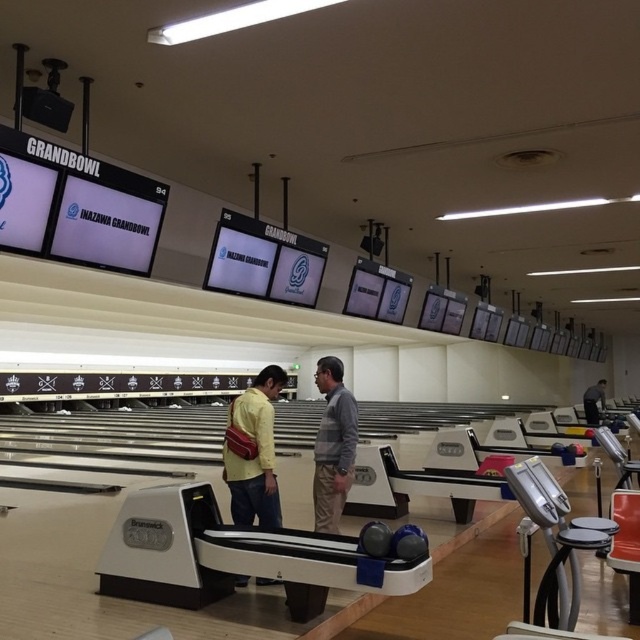
You are a customer at GRANDBOWL and you see two people wearing a yellow matte shirt at center and a gray sweater at center. Which one is on the left side?

The yellow matte shirt at center is to the left of the gray sweater at center, so the person wearing the yellow matte shirt at center is on the left side.

Based on the photo, you are standing at the entrance of GRANDBOWL and see a point marked at coordinates (253, 452). What object is located at that point?

The point at coordinates (253, 452) marks the yellow matte shirt at center.

You are a customer at GRANDBOWL and you see two people wearing the yellow matte shirt at center and the gray sweater at center. Which one is closer to the floor?

The yellow matte shirt at center is closer to the floor because it is below the gray sweater at center.